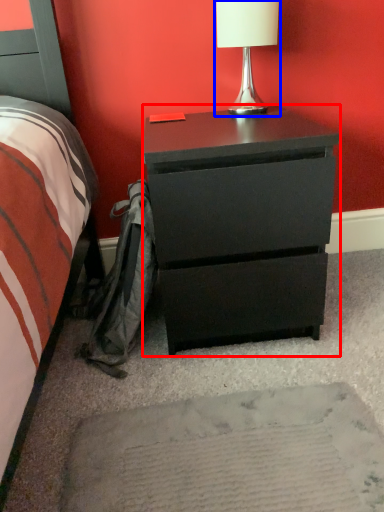
Question: Which object is further to the camera taking this photo, chest of drawers (highlighted by a red box) or table lamp (highlighted by a blue box)?

Choices:
 (A) chest of drawers
 (B) table lamp

Answer: (B)